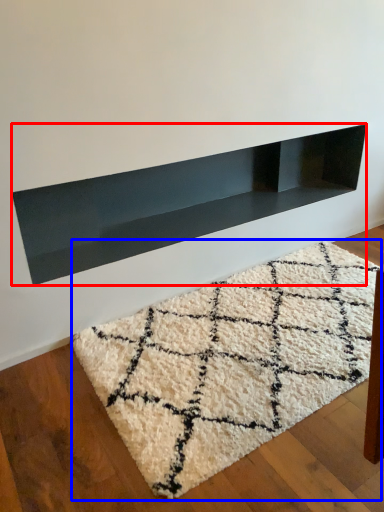
Question: Among these objects, which one is farthest to the camera, shelf (highlighted by a red box) or mat (highlighted by a blue box)?

Choices:
 (A) shelf
 (B) mat

Answer: (A)